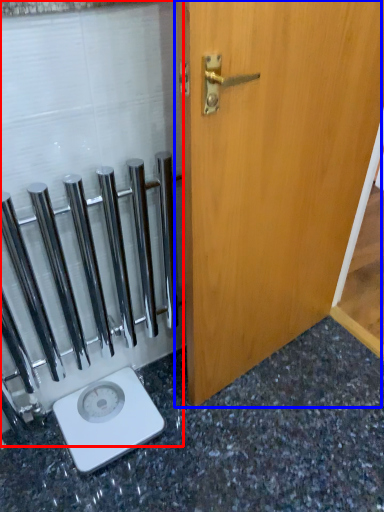
Question: Which point is further to the camera, glass door (highlighted by a red box) or door (highlighted by a blue box)?

Choices:
 (A) glass door
 (B) door

Answer: (A)